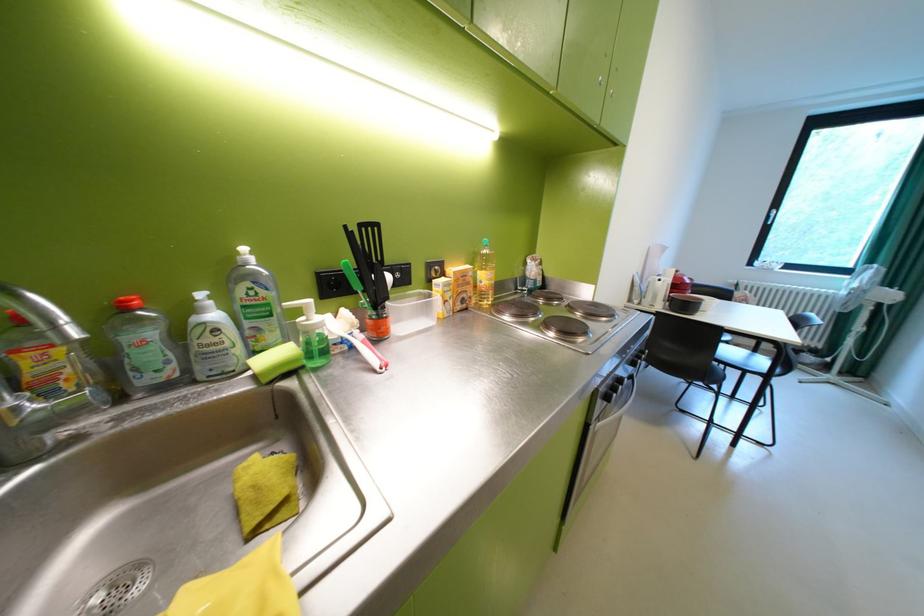
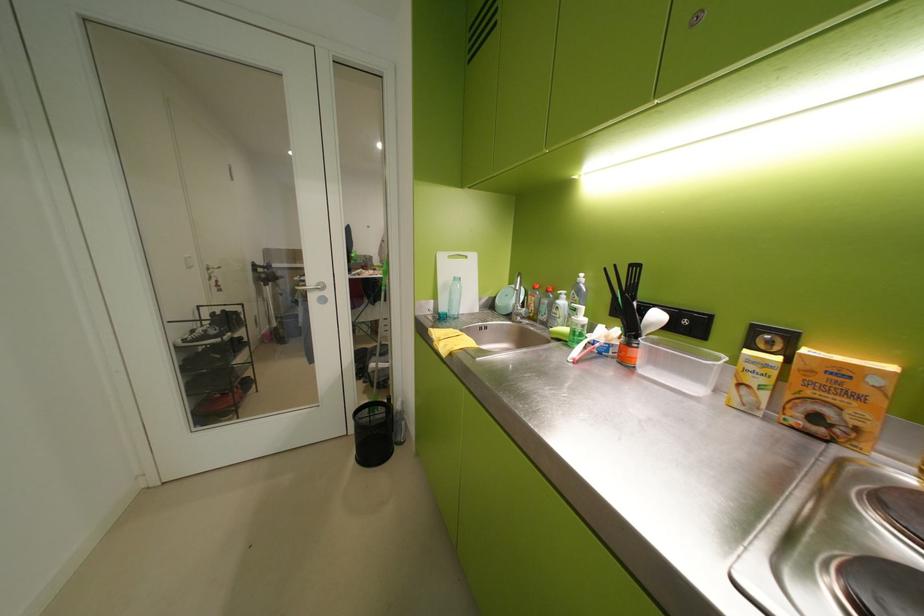
The point at (402,321) is marked in the first image. Where is the corresponding point in the second image?

(650, 354)